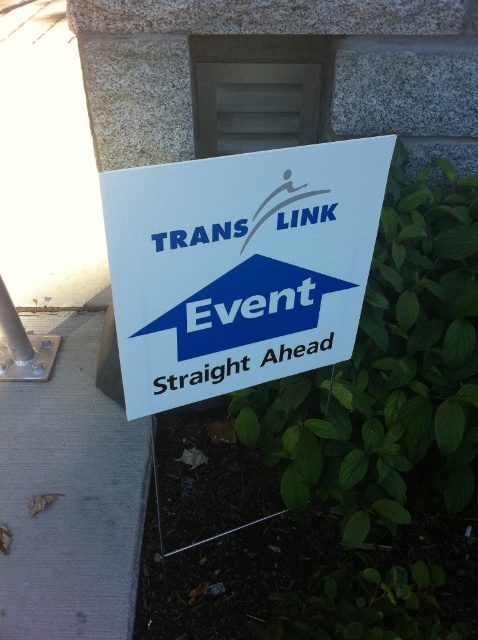
You are a delivery person who needs to find the TRANS LINK event location. You are currently standing at the point marked by the coordinates point (238, 268). According to the image, which direction should you go?

The white paper sign at center located at point (238, 268) indicates that the TRANS LINK event is straight ahead, so you should go straight ahead.

You are a pedestrian walking towards the blue paper sign at center and the gray concrete pavement at lower left. Which object will you encounter first?

The gray concrete pavement at lower left is positioned on the left side of the blue paper sign at center, so you will encounter the blue paper sign at center first as you walk towards it.